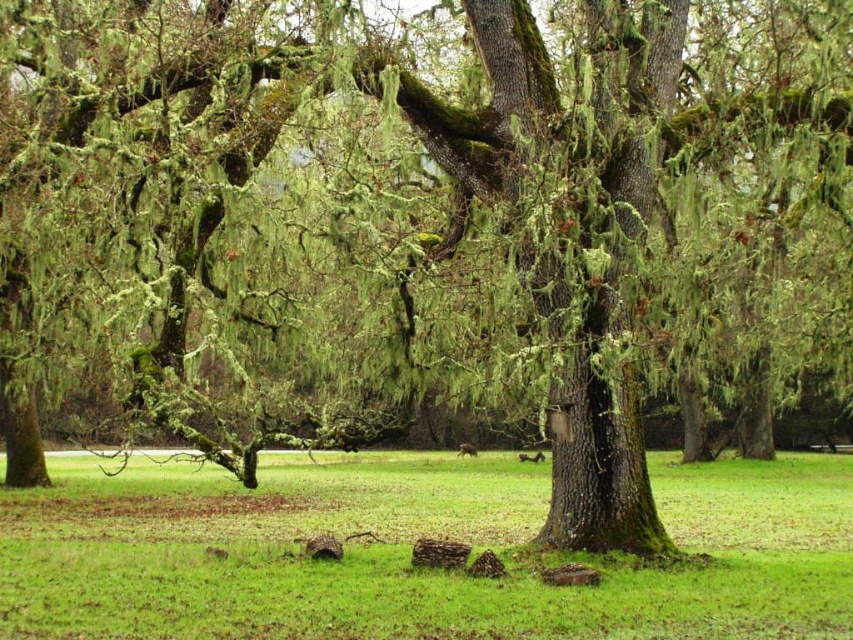
Question: Which object is closer to the camera taking this photo?

Choices:
 (A) brown furry squirrel at center
 (B) green grass at center

Answer: (B)

Question: Which point is farther to the camera?

Choices:
 (A) green grass at center
 (B) brown furry squirrel at center

Answer: (B)

Question: Does green grass at center lie in front of brown furry squirrel at center?

Choices:
 (A) no
 (B) yes

Answer: (B)

Question: Which of the following is the farthest from the observer?

Choices:
 (A) (460, 452)
 (B) (762, 540)

Answer: (A)

Question: Is green grass at center positioned behind brown furry squirrel at center?

Choices:
 (A) no
 (B) yes

Answer: (A)

Question: In this image, where is green grass at center located relative to brown furry squirrel at center?

Choices:
 (A) left
 (B) right

Answer: (A)